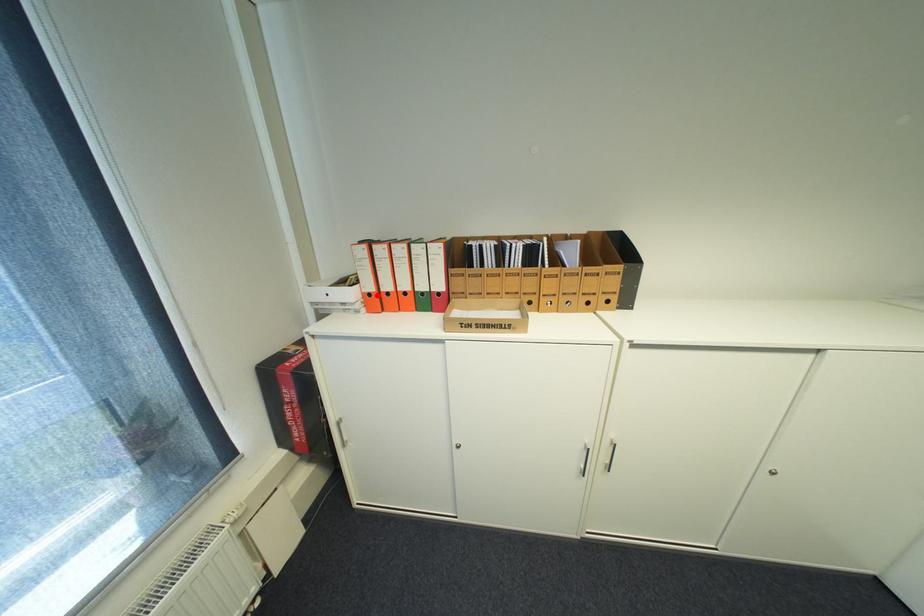
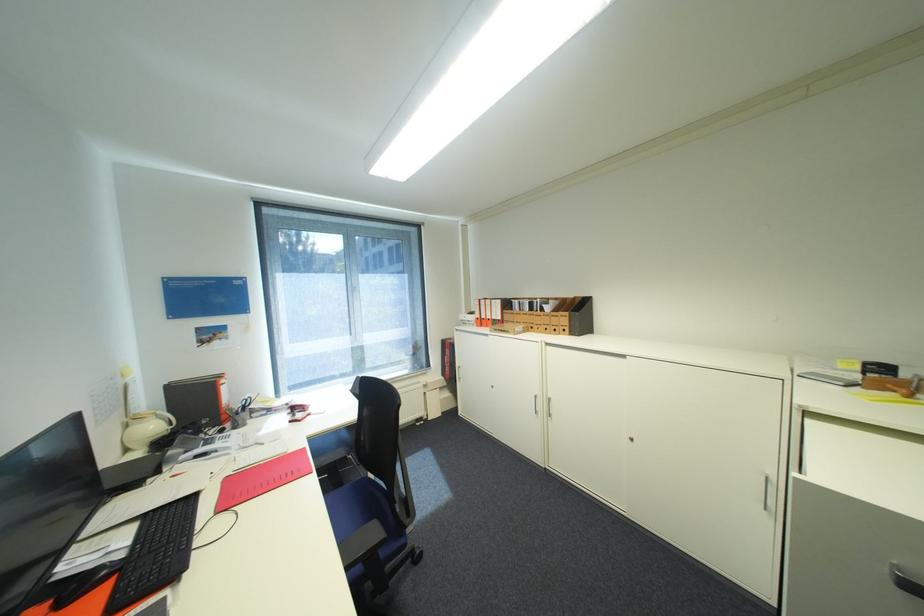
The point at the highlighted location is marked in the first image. Where is the corresponding point in the second image?

(485, 318)